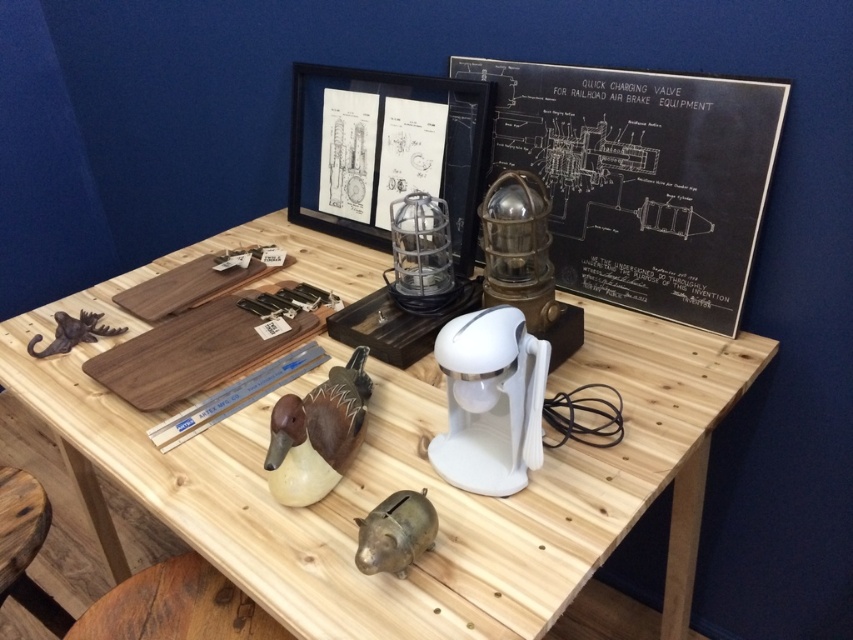
Question: Which object is the closest to the blackboard at upper right?

Choices:
 (A) natural wood table at center
 (B) brown matte duck at center
 (C) black paperboard at center

Answer: (C)

Question: Can you confirm if black paperboard at center is smaller than brass piggy bank at center?

Choices:
 (A) yes
 (B) no

Answer: (B)

Question: Can you confirm if black paperboard at center is positioned to the right of brown matte duck at center?

Choices:
 (A) no
 (B) yes

Answer: (B)

Question: Which of the following is the farthest from the observer?

Choices:
 (A) brass piggy bank at center
 (B) blackboard at upper right
 (C) brown matte duck at center
 (D) natural wood table at center

Answer: (B)

Question: Which object is the farthest from the brass piggy bank at center?

Choices:
 (A) brown matte hook at left
 (B) brown matte duck at center

Answer: (A)

Question: Can you confirm if blackboard at upper right is positioned to the left of brown matte duck at center?

Choices:
 (A) no
 (B) yes

Answer: (A)